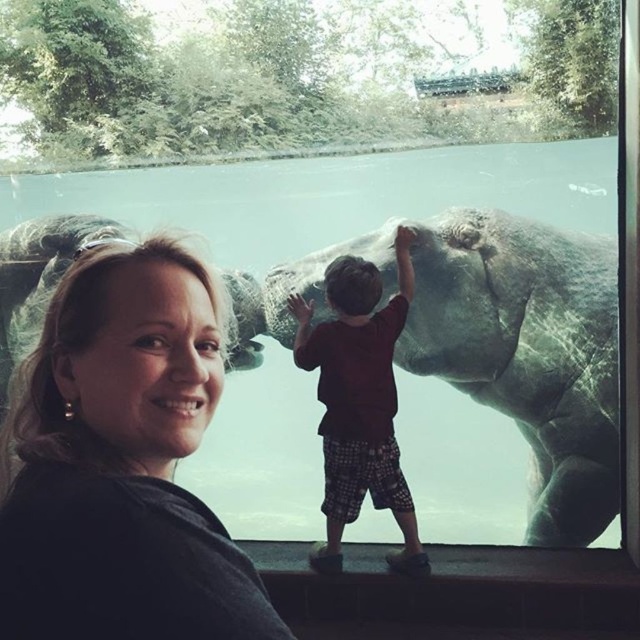
You are a visitor at the zoo and want to take a photo of the matte black hair at upper left. Where should you position yourself to capture it in the frame?

To capture the matte black hair at upper left in your photo, position yourself so that the camera is aimed at the coordinates point (x=120, y=461).

You are standing at the point labeled point (x=609, y=244) and want to get to the point labeled point (x=28, y=388). Which direction should you move to reach your destination?

You should move forward to reach point (x=28, y=388) because it is located in front of point (x=609, y=244).

In the image, there is a woman with light brown hair and a child on a raised platform. Where is the point at coordinates (120, 461) located?

Result: The point at coordinates (120, 461) is located at the matte black hair at upper left.